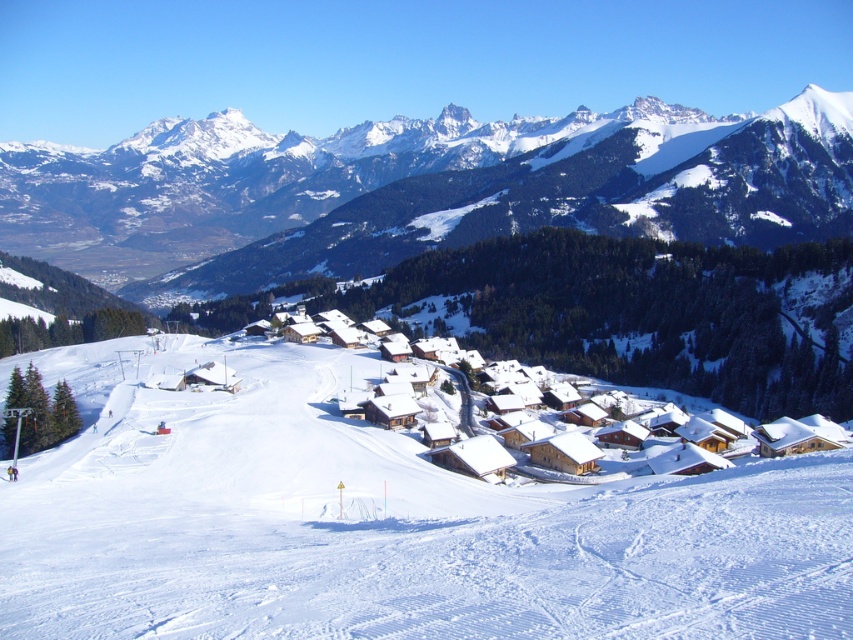
Question: Based on their relative distances, which object is farther from the snowy rocky mountain range at upper center?

Choices:
 (A) wooden chalet at center
 (B) white snow ski slope at center

Answer: (B)

Question: Is white snow ski slope at center further to camera compared to wooden chalet at center?

Choices:
 (A) yes
 (B) no

Answer: (B)

Question: Observing the image, what is the correct spatial positioning of snowy rocky mountain range at upper center in reference to wooden chalet at center?

Choices:
 (A) right
 (B) left

Answer: (B)

Question: Considering the relative positions of white snow ski slope at center and snowy rocky mountain range at upper center in the image provided, where is white snow ski slope at center located with respect to snowy rocky mountain range at upper center?

Choices:
 (A) left
 (B) right

Answer: (B)

Question: Which of the following is the farthest from the observer?

Choices:
 (A) wooden chalet at center
 (B) snowy rocky mountain range at upper center

Answer: (B)

Question: Among these points, which one is farthest from the camera?

Choices:
 (A) (570, 442)
 (B) (299, 205)

Answer: (B)